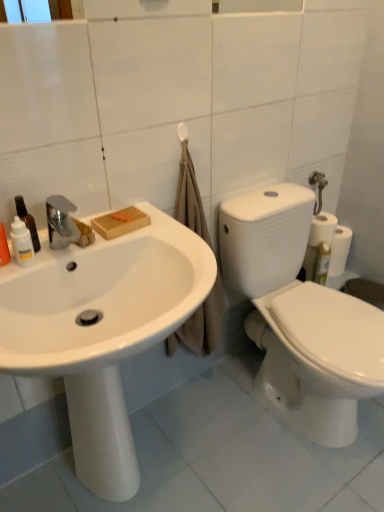
Question: Is translucent plastic spray bottle at left, which appears as the second cleaning product when viewed from the right, at the back of translucent plastic bottle at left, which ranks as the second cleaning product in left-to-right order?

Choices:
 (A) no
 (B) yes

Answer: (A)

Question: Can you confirm if translucent plastic bottle at left, positioned as the first cleaning product in right-to-left order, is bigger than translucent plastic spray bottle at left, which is counted as the 1th cleaning product, starting from the left?

Choices:
 (A) no
 (B) yes

Answer: (B)

Question: Is translucent plastic bottle at left, positioned as the first cleaning product in right-to-left order, aimed at translucent plastic spray bottle at left, which is counted as the 1th cleaning product, starting from the left?

Choices:
 (A) yes
 (B) no

Answer: (B)

Question: From the image's perspective, is translucent plastic bottle at left, which ranks as the second cleaning product in left-to-right order, below translucent plastic spray bottle at left, which appears as the second cleaning product when viewed from the right?

Choices:
 (A) no
 (B) yes

Answer: (A)

Question: Is translucent plastic bottle at left, which ranks as the second cleaning product in left-to-right order, to the left of translucent plastic spray bottle at left, which is counted as the 1th cleaning product, starting from the left, from the viewer's perspective?

Choices:
 (A) yes
 (B) no

Answer: (B)

Question: Considering the relative sizes of translucent plastic bottle at left, which ranks as the second cleaning product in left-to-right order, and translucent plastic spray bottle at left, which is counted as the 1th cleaning product, starting from the left, in the image provided, is translucent plastic bottle at left, which ranks as the second cleaning product in left-to-right order, thinner than translucent plastic spray bottle at left, which is counted as the 1th cleaning product, starting from the left,?

Choices:
 (A) no
 (B) yes

Answer: (A)

Question: Can you confirm if white matte towel bar at upper center is smaller than translucent plastic spray bottle at left, which is counted as the 1th cleaning product, starting from the left?

Choices:
 (A) yes
 (B) no

Answer: (A)

Question: Does white matte towel bar at upper center have a lesser width compared to translucent plastic spray bottle at left, which is counted as the 1th cleaning product, starting from the left?

Choices:
 (A) no
 (B) yes

Answer: (B)

Question: Is white matte towel bar at upper center looking in the opposite direction of translucent plastic spray bottle at left, which is counted as the 1th cleaning product, starting from the left?

Choices:
 (A) yes
 (B) no

Answer: (B)

Question: Is white matte towel bar at upper center in front of translucent plastic spray bottle at left, which is counted as the 1th cleaning product, starting from the left?

Choices:
 (A) yes
 (B) no

Answer: (B)

Question: Is white matte towel bar at upper center at the left side of translucent plastic spray bottle at left, which appears as the second cleaning product when viewed from the right?

Choices:
 (A) yes
 (B) no

Answer: (B)

Question: Does white matte towel bar at upper center turn towards translucent plastic spray bottle at left, which appears as the second cleaning product when viewed from the right?

Choices:
 (A) no
 (B) yes

Answer: (A)

Question: Considering the relative sizes of white matte towel bar at upper center and white glossy bottle at left in the image provided, is white matte towel bar at upper center smaller than white glossy bottle at left?

Choices:
 (A) yes
 (B) no

Answer: (A)